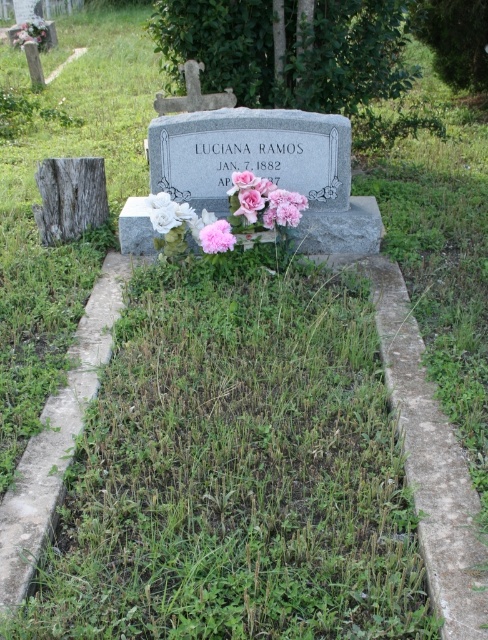
You are standing at the entrance of the cemetery and want to place a bouquet of flowers at the smooth gray stone at center. According to the map coordinates, where should you aim to place the bouquet?

The smooth gray stone at center is located at coordinates point (69, 196), so you should aim for that point to place the bouquet there.

You are standing in a cemetery and see the smooth gray stone at center and the white matte flower at lower left. Which object is located to the left of the other?

The smooth gray stone at center is positioned on the left side of white matte flower at lower left.

You are a gardener tasked with placing a new pink matte flower at center in front of the smooth gray stone at center. Given their sizes, will the flower fit comfortably without being too cramped?

The smooth gray stone at center is wider than the pink matte flower at center, so placing the flower in front of it should leave enough space for the flower to be comfortable and not cramped.